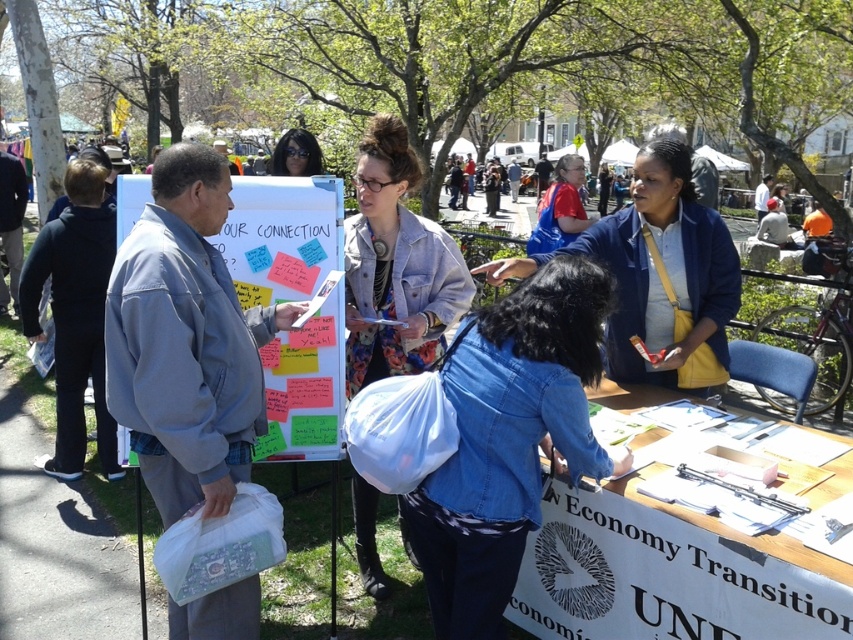
Question: Is wooden table at lower center smaller than denim jacket at center?

Choices:
 (A) no
 (B) yes

Answer: (A)

Question: Can you confirm if denim jacket at left is positioned to the left of wooden table at lower center?

Choices:
 (A) yes
 (B) no

Answer: (A)

Question: Which point is farther to the camera?

Choices:
 (A) matte black hair at upper center
 (B) matte blue jacket at center

Answer: (A)

Question: Observing the image, what is the correct spatial positioning of denim jacket at left in reference to denim jacket at center?

Choices:
 (A) left
 (B) right

Answer: (A)

Question: Estimate the real-world distances between objects in this image. Which object is farther from the denim jacket at left?

Choices:
 (A) denim jacket at lower right
 (B) matte black hair at upper center
 (C) denim jacket at center

Answer: (B)

Question: Among these objects, which one is nearest to the camera?

Choices:
 (A) denim jacket at center
 (B) wooden table at lower center

Answer: (B)